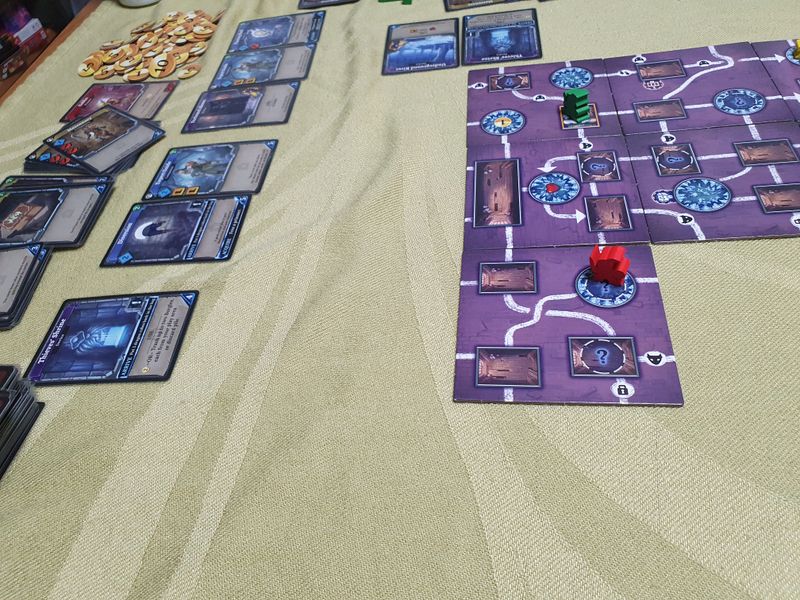
The width and height of the screenshot is (800, 600). In order to click on wood bed frame in this screenshot , I will do `click(64, 35)`.